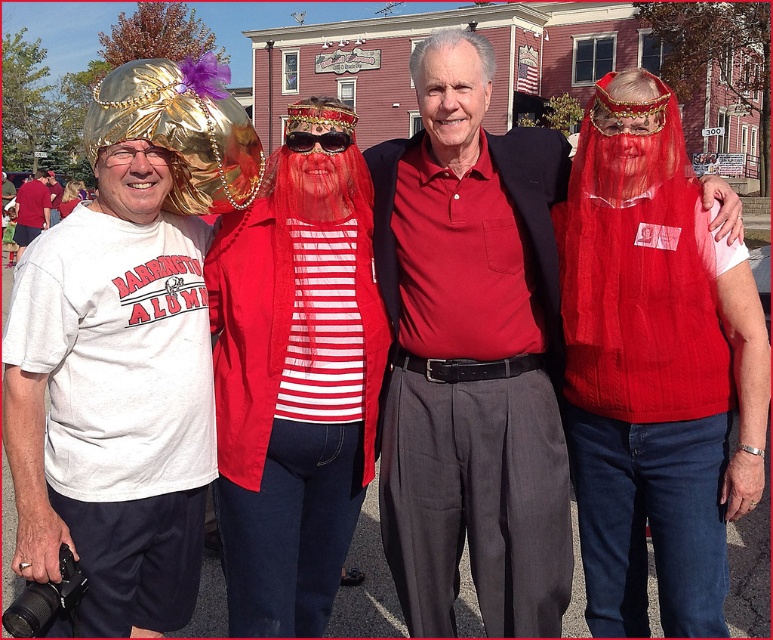
Question: Among these points, which one is nearest to the camera?

Choices:
 (A) (97, 129)
 (B) (301, 465)

Answer: (A)

Question: Does metallic gold turban at left have a greater width compared to matte white t-shirt at left?

Choices:
 (A) no
 (B) yes

Answer: (A)

Question: Is metallic gold turban at left bigger than sunglasses at center?

Choices:
 (A) yes
 (B) no

Answer: (B)

Question: Which is farther from the metallic gold turban at left?

Choices:
 (A) matte white t-shirt at left
 (B) red matte veil at center

Answer: (A)

Question: Which of these objects is positioned farthest from the red matte veil at center?

Choices:
 (A) metallic gold turban at left
 (B) matte white t-shirt at left

Answer: (B)

Question: Is metallic gold turban at left closer to camera compared to red matte veil at center?

Choices:
 (A) no
 (B) yes

Answer: (B)